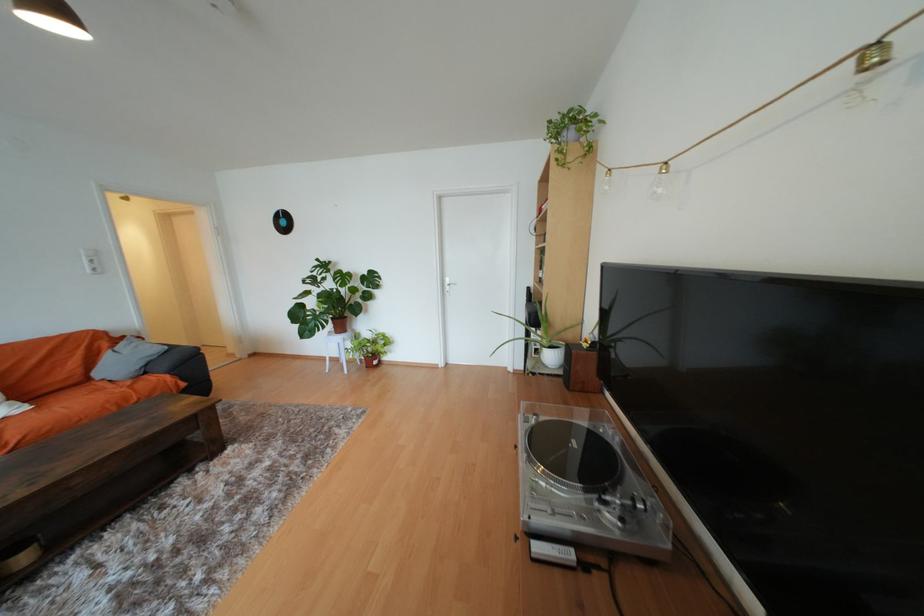
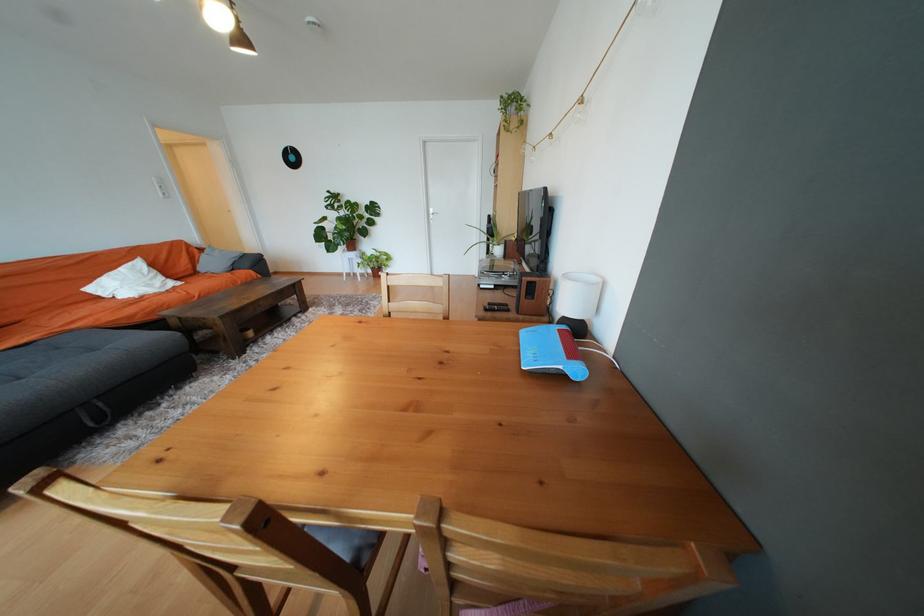
Question: I am providing you with two images of the same scene from different viewpoints. Please identify which objects are invisible in image2.

Choices:
 (A) wooden speaker
 (B) black remote control
 (C) terracotta plant pot
 (D) none of these

Answer: (D)